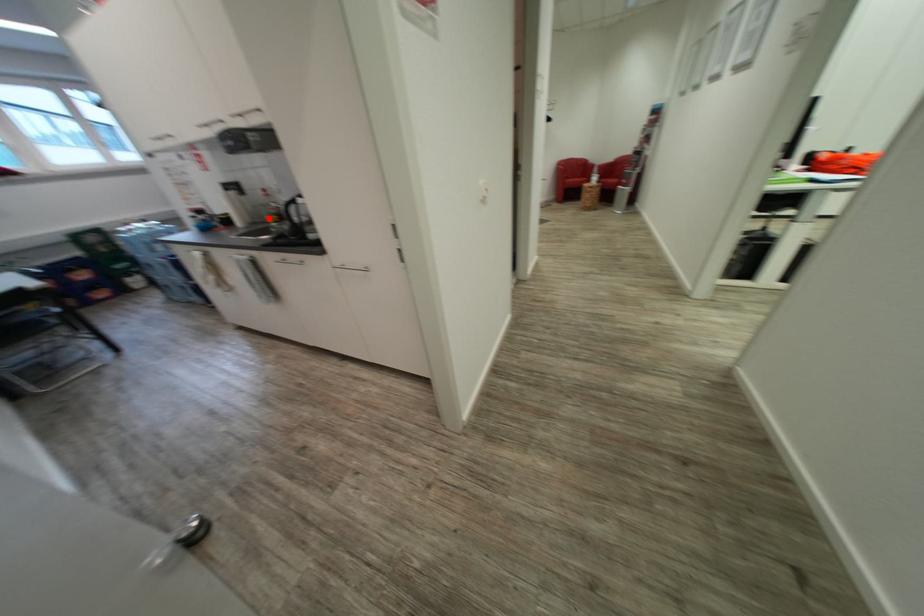
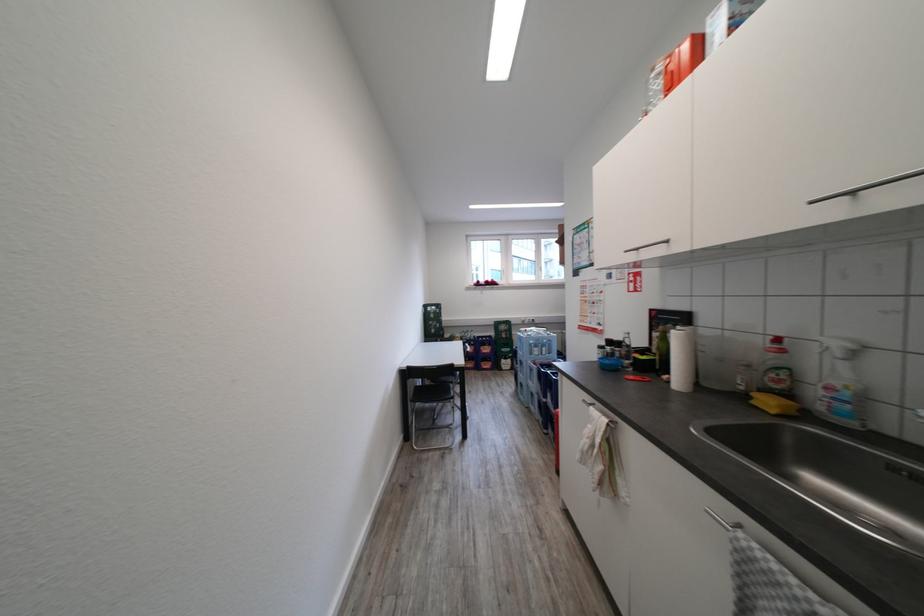
In the second image, find the point that corresponds to the highlighted location in the first image.

(768, 402)